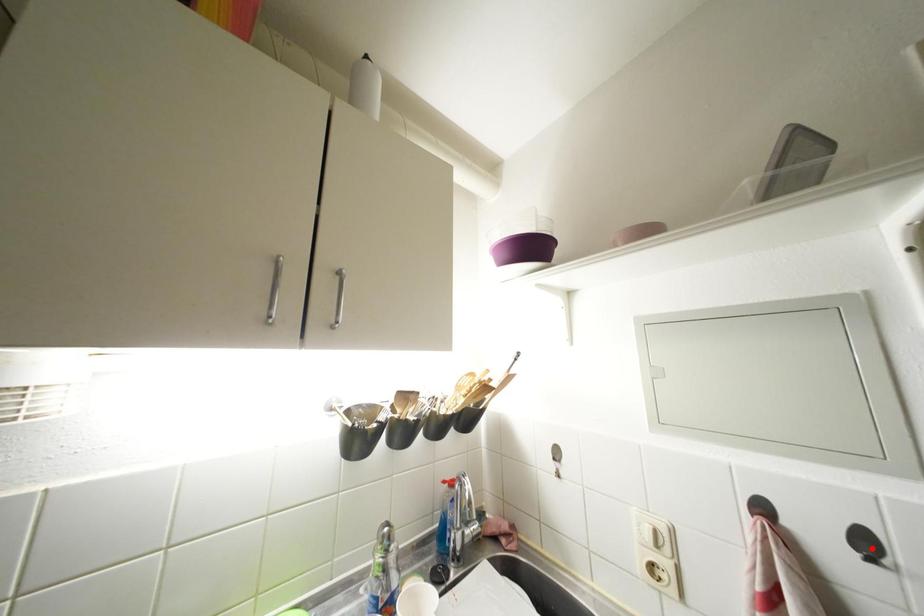
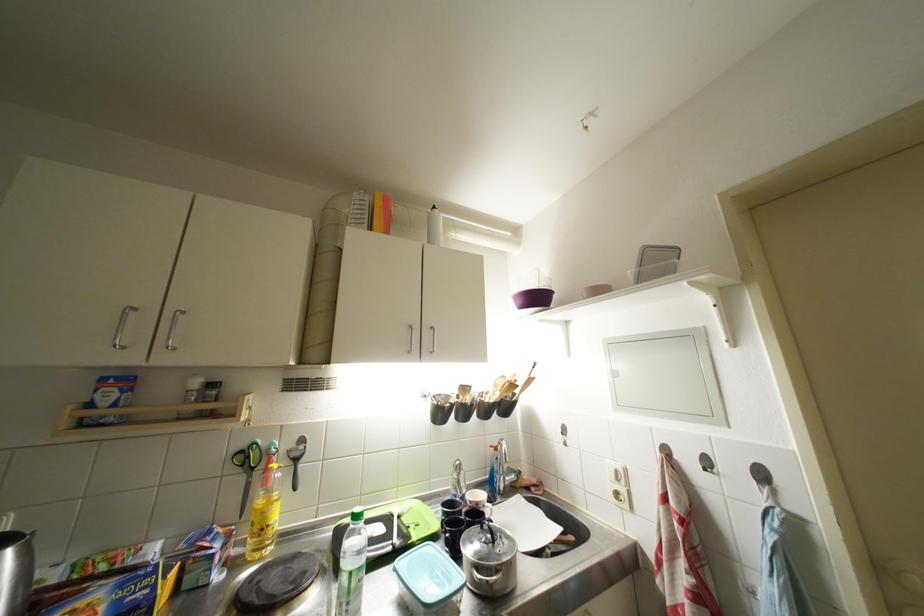
Find the pixel in the second image that matches the highlighted location in the first image.

(714, 467)